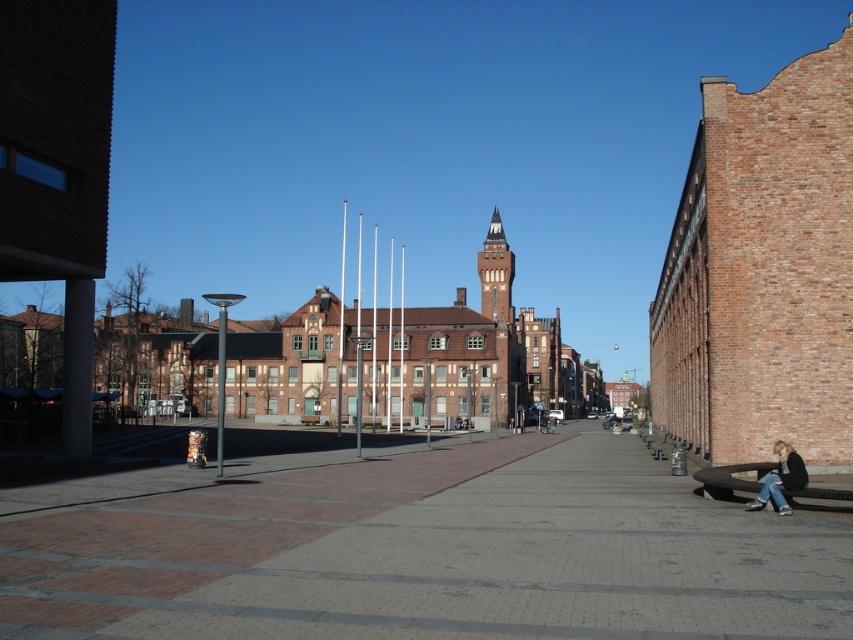
Question: Can you confirm if brick pavement at center is positioned to the right of denim jeans at lower right?

Choices:
 (A) yes
 (B) no

Answer: (B)

Question: Can you confirm if brick pavement at center is smaller than denim jeans at lower right?

Choices:
 (A) no
 (B) yes

Answer: (A)

Question: Does brick pavement at center appear over denim jeans at lower right?

Choices:
 (A) yes
 (B) no

Answer: (B)

Question: Which object is closer to the camera taking this photo?

Choices:
 (A) denim jeans at lower right
 (B) brick pavement at center

Answer: (B)